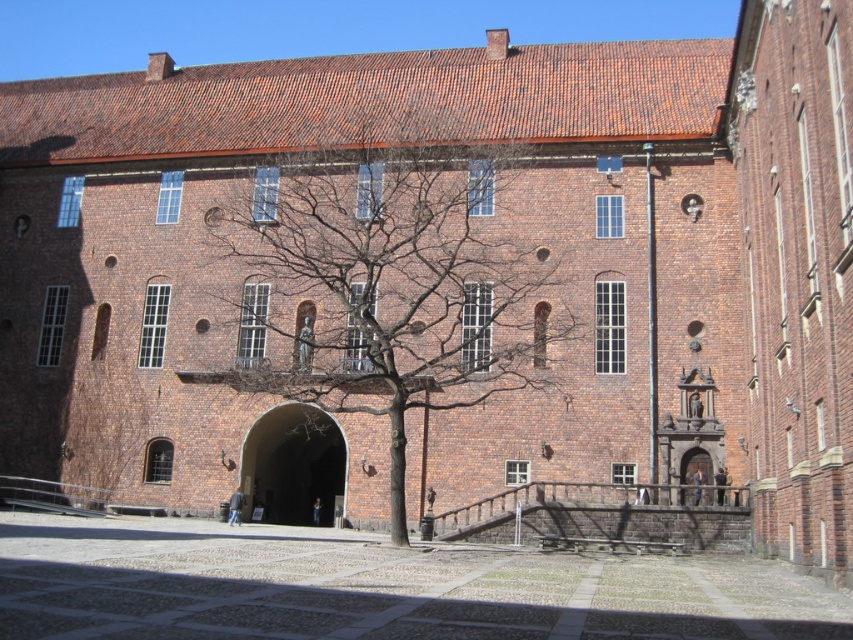
You are standing 40 meters away from the historic brick building. You see the bare branches at center in front of it. Can you safely walk towards the building without getting too close to the branches?

The distance of the bare branches at center from the viewer is 41.55 meters. Since you are standing 40 meters away from the building, the branches are 1.55 meters in front of you. Therefore, you can safely walk towards the building without getting too close to the branches.

You are a delivery person trying to deliver a package to the wooden door at center. The package is 2 meters tall. Can you fit it through the brown stone archway at center without tilting it?

The brown stone archway at center is taller than the wooden door at center. Since the package is 2 meters tall, and the archway is higher than the door, it is likely that the archway can accommodate the package without tilting it. However, the exact height of the archway isn

You are a visitor approaching the wooden door at center of the historic brick building. As you walk towards the door, you notice the bare branches at center. Where are the branches in relation to the door?

The bare branches at center are above the wooden door at center.